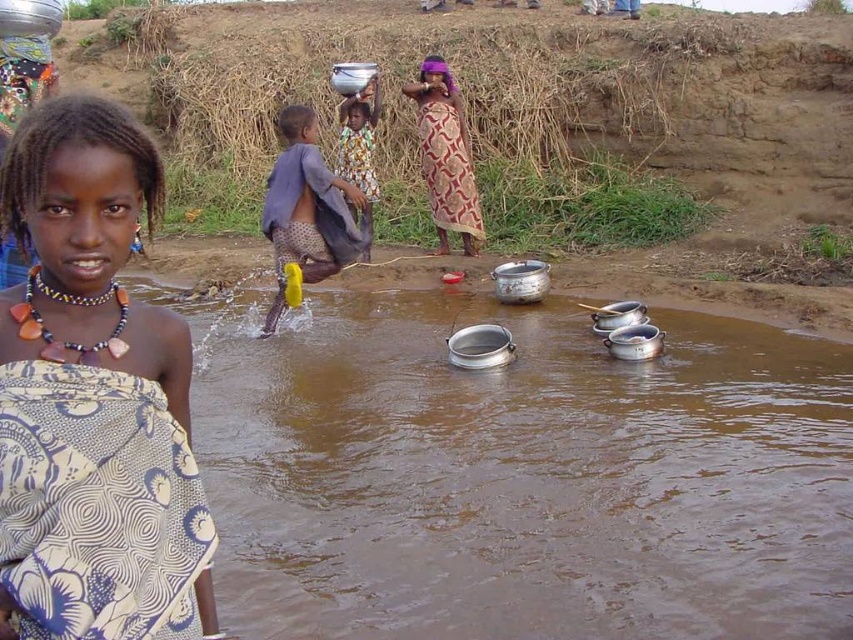
Question: Which object appears closest to the camera in this image?

Choices:
 (A) metallic silver pot at upper center
 (B) yellow fabric cloth at center
 (C) brown metallic pots at center

Answer: (C)

Question: Does brown metallic pots at center appear on the left side of patterned fabric dress at center?

Choices:
 (A) no
 (B) yes

Answer: (A)

Question: Among these objects, which one is farthest from the camera?

Choices:
 (A) yellow fabric cloth at center
 (B) metallic silver pot at upper center
 (C) patterned fabric wrap at left
 (D) brown metallic pots at center

Answer: (B)

Question: Is brown metallic pots at center positioned behind patterned fabric wrap at left?

Choices:
 (A) no
 (B) yes

Answer: (B)

Question: Does yellow fabric cloth at center have a larger size compared to metallic silver pot at upper center?

Choices:
 (A) no
 (B) yes

Answer: (B)

Question: Which point is closer to the camera taking this photo?

Choices:
 (A) (477, 230)
 (B) (281, 156)

Answer: (A)